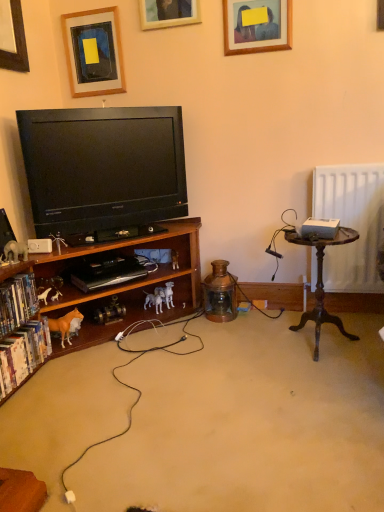
The image size is (384, 512). I want to click on empty space that is in between hardcover book at lower left, which is the 2th book in top-to-bottom order, and wooden vintage table at right, so click(197, 364).